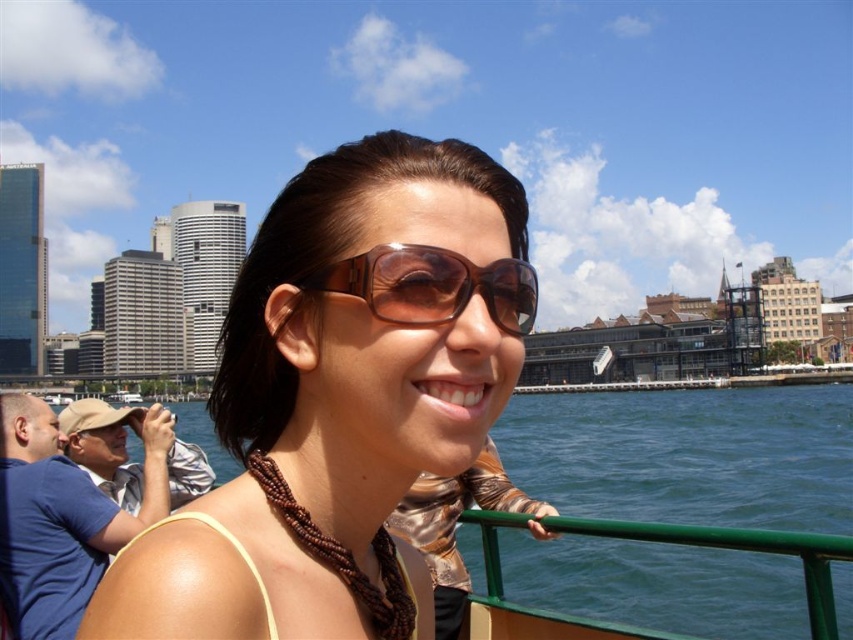
Question: Among these objects, which one is nearest to the camera?

Choices:
 (A) brown leather sunglasses at center
 (B) blue water at lower right

Answer: (A)

Question: Which object is farther from the camera taking this photo?

Choices:
 (A) brown shiny sunglasses at center
 (B) brown leather sunglasses at center
 (C) blue water at lower right

Answer: (C)

Question: Can you confirm if brown leather sunglasses at center is bigger than brown shiny sunglasses at center?

Choices:
 (A) yes
 (B) no

Answer: (A)

Question: Among these objects, which one is nearest to the camera?

Choices:
 (A) brown shiny sunglasses at center
 (B) brown leather sunglasses at center
 (C) blue water at lower right

Answer: (B)

Question: Does blue water at lower right have a smaller size compared to brown shiny sunglasses at center?

Choices:
 (A) no
 (B) yes

Answer: (A)

Question: Can you confirm if brown leather sunglasses at center is wider than blue water at lower right?

Choices:
 (A) no
 (B) yes

Answer: (A)